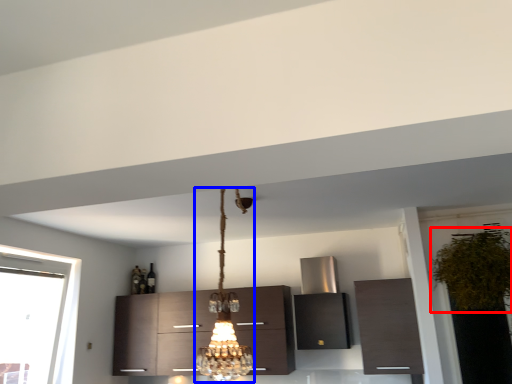
Question: Which object is further to the camera taking this photo, plant (highlighted by a red box) or lamp (highlighted by a blue box)?

Choices:
 (A) plant
 (B) lamp

Answer: (A)